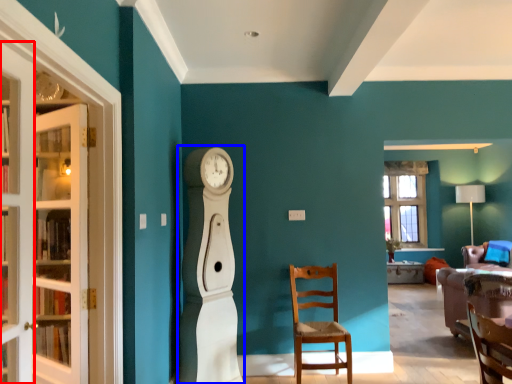
Question: Among these objects, which one is farthest to the camera, door (highlighted by a red box) or open (highlighted by a blue box)?

Choices:
 (A) door
 (B) open

Answer: (B)